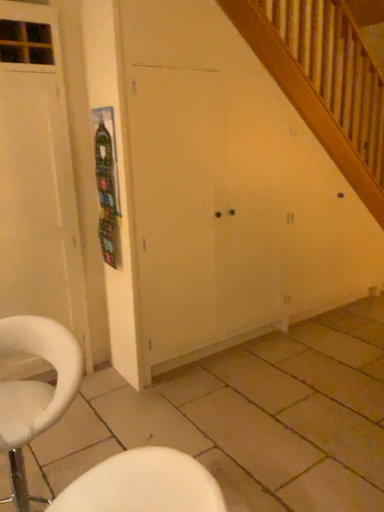
Find the location of a particular element. Image resolution: width=384 pixels, height=512 pixels. vacant space to the right of white matte cabinet at center is located at coordinates (309, 351).